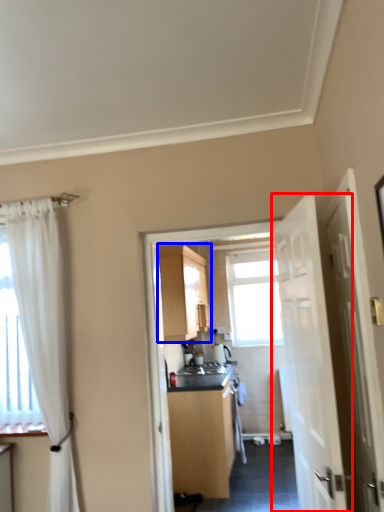
Question: Which point is further to the camera, door (highlighted by a red box) or cabinetry (highlighted by a blue box)?

Choices:
 (A) door
 (B) cabinetry

Answer: (B)